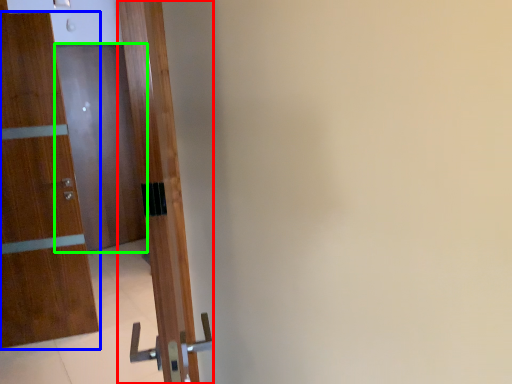
Question: Which is farther away from door (highlighted by a red box)? door (highlighted by a blue box) or door (highlighted by a green box)?

Choices:
 (A) door
 (B) door

Answer: (B)